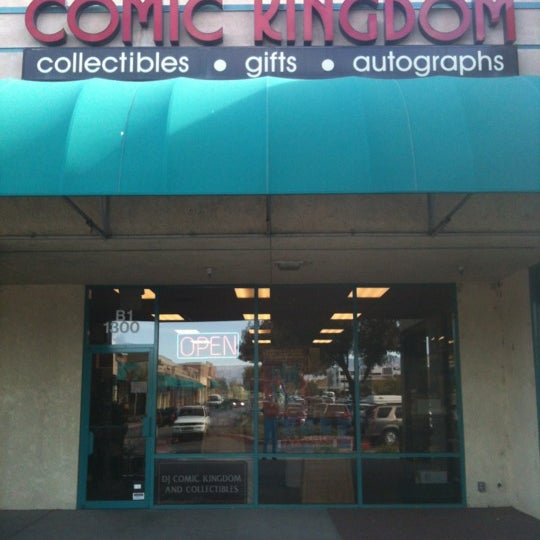
Image resolution: width=540 pixels, height=540 pixels. Identify the location of wall. (40, 355), (30, 425), (471, 355), (525, 364).